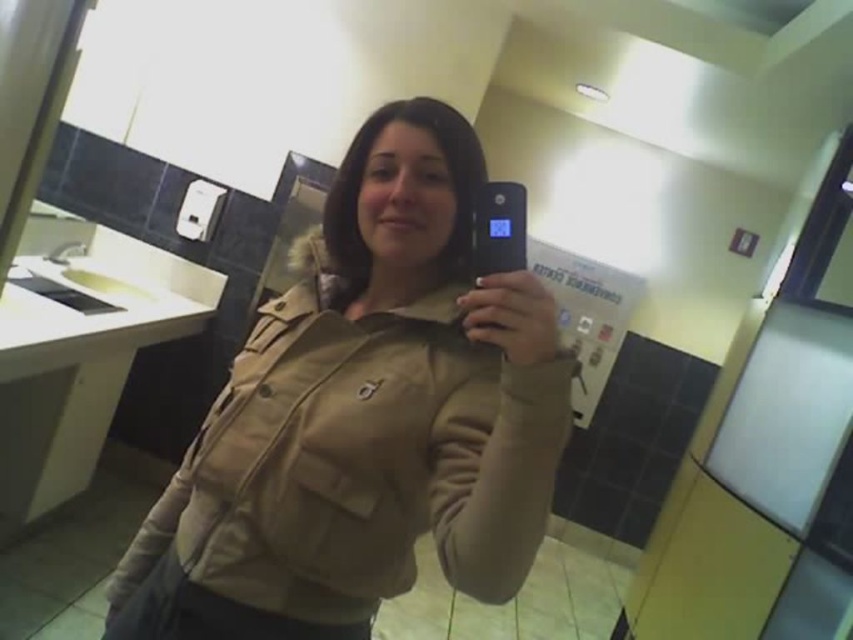
You are trying to take a photo of the white glossy sink at left using your black plastic phone at center. However, there is an obstacle blocking your view. Based on the scene description, what is the obstacle?

The obstacle is the white glossy sink at left itself because the black plastic phone at center is positioned behind it, blocking the view.

You are trying to place the black plastic phone at center on the white glossy sink at left. Will it fit without hanging over the edge?

The white glossy sink at left might be wider than black plastic phone at center, so there is a possibility that the phone will fit without overhanging, but it is uncertain due to the comparative width mentioned.

You are taking a selfie in a restroom and wearing a matte khaki jacket at center. If your phone is 24.18 inches away from the jacket, will the jacket appear larger or smaller in the photo compared to if you moved closer to it?

The matte khaki jacket at center is 24.18 inches away from the camera. If you move closer to the jacket, it would appear larger in the photo because objects closer to the camera appear bigger.